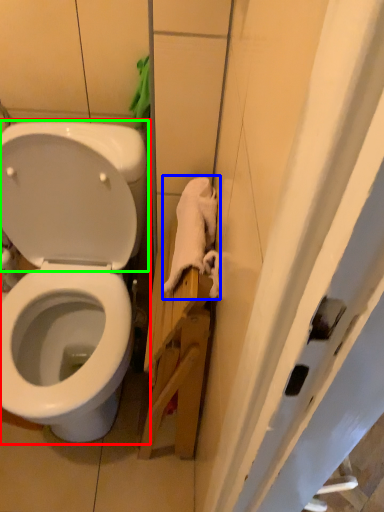
Question: Considering the real-world distances, which object is closest to toilet (highlighted by a red box)? material (highlighted by a blue box) or back (highlighted by a green box).

Choices:
 (A) material
 (B) back

Answer: (B)